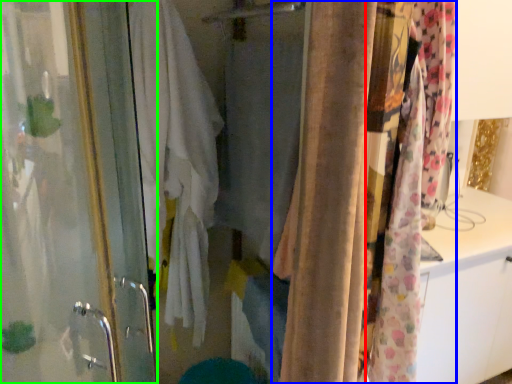
Question: Considering the real-world distances, which object is closest to curtain (highlighted by a red box)? curtain (highlighted by a blue box) or screen door (highlighted by a green box).

Choices:
 (A) curtain
 (B) screen door

Answer: (A)